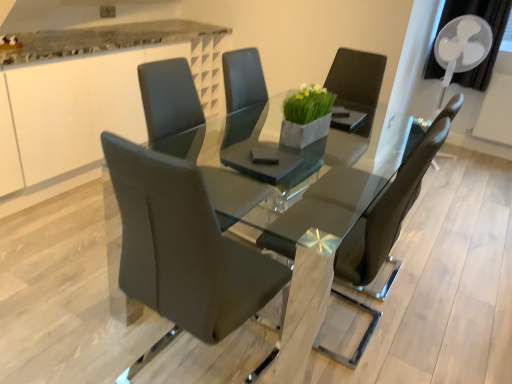
Image resolution: width=512 pixels, height=384 pixels. Identify the location of vacant space to the right of matte black chair at center, which is counted as the 2th chair, starting from the back. (425, 336).